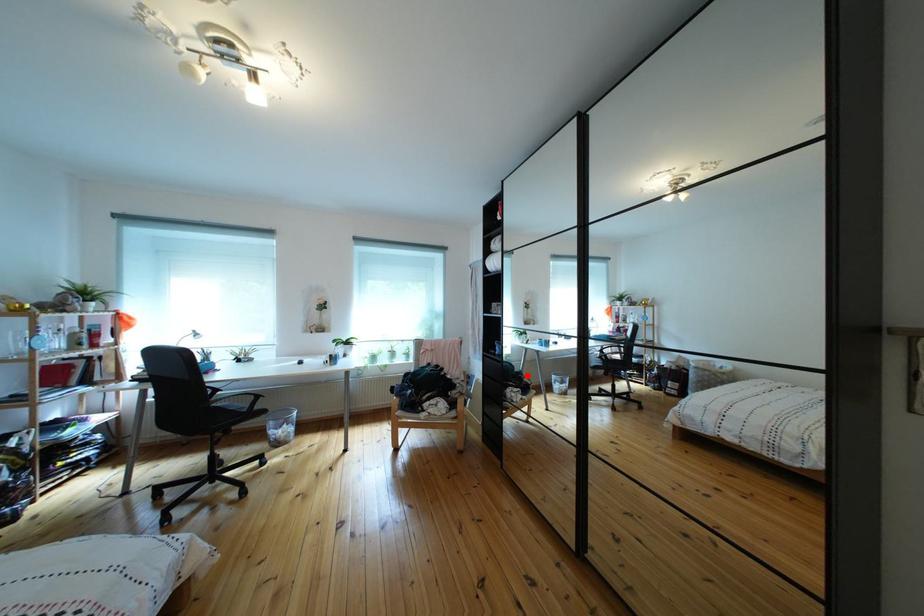
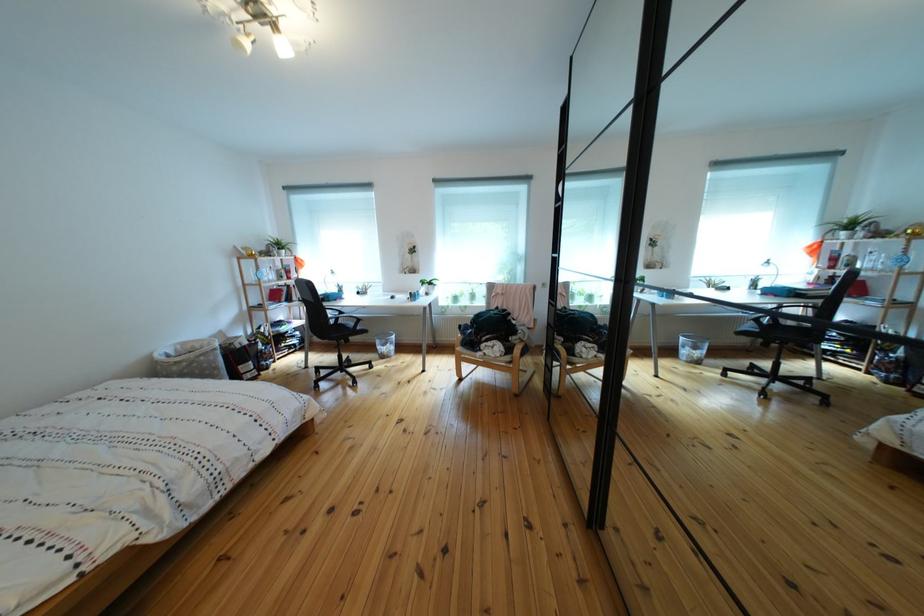
Question: I am providing you with two images of the same scene from different viewpoints. A red point is marked on the first image. Is the red point's position out of view in image 2?

Choices:
 (A) Yes
 (B) No

Answer: (B)